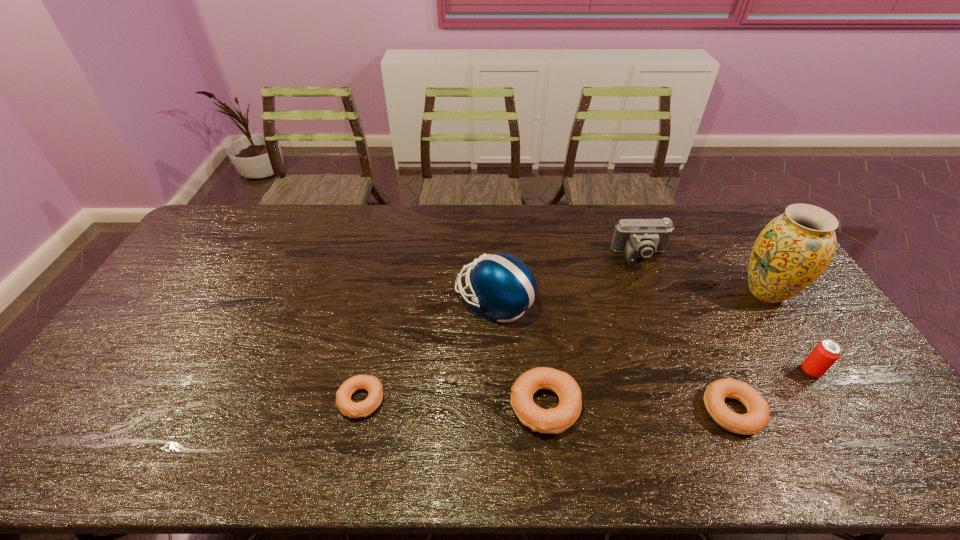
Where is `vacant area between the rightmost bagel and the camera`? vacant area between the rightmost bagel and the camera is located at coordinates (686, 334).

Locate an element on the screen. The width and height of the screenshot is (960, 540). free space between the tallest object and the fifth tallest object is located at coordinates (656, 348).

Image resolution: width=960 pixels, height=540 pixels. I want to click on free space between the shortest object and the vase, so click(x=564, y=346).

Identify the location of free point between the second bagel from right to left and the football helmet. The image size is (960, 540). (519, 354).

Locate an element on the screen. vacant region between the fourth tallest object and the second tallest bagel is located at coordinates (771, 391).

Locate an element on the screen. unoccupied area between the tallest bagel and the camera is located at coordinates (593, 332).

Identify the location of object that is the fourth closest to the leftmost object. (641, 238).

Find the location of a particular element. The height and width of the screenshot is (540, 960). the closest object to the third shortest object is located at coordinates (503, 287).

Identify which bagel is the third closest to the camera. Please provide its 2D coordinates. Your answer should be formatted as a tuple, i.e. [(x, y)], where the tuple contains the x and y coordinates of a point satisfying the conditions above.

[(347, 407)]

Image resolution: width=960 pixels, height=540 pixels. What are the coordinates of `bagel object that ranks as the second closest to the second tallest object` in the screenshot? It's located at coord(347,407).